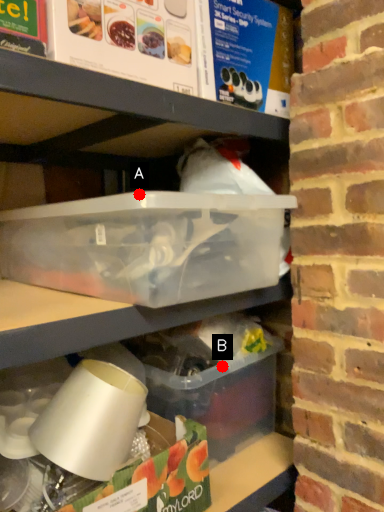
Question: Two points are circled on the image, labeled by A and B beside each circle. Which point is closer to the camera taking this photo?

Choices:
 (A) A is closer
 (B) B is closer

Answer: (A)